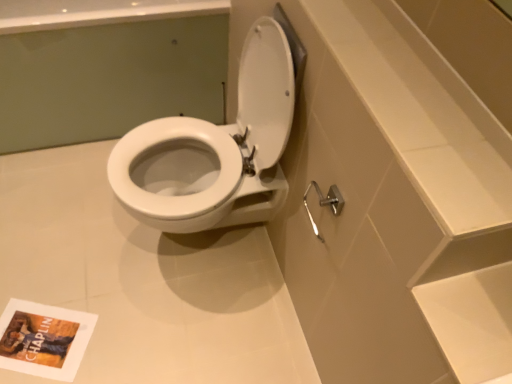
Question: Considering the relative positions of satin nickel shower arm at lower right and white glossy toilet at center in the image provided, is satin nickel shower arm at lower right to the right of white glossy toilet at center from the viewer's perspective?

Choices:
 (A) no
 (B) yes

Answer: (B)

Question: Does satin nickel shower arm at lower right have a lesser height compared to white glossy toilet at center?

Choices:
 (A) yes
 (B) no

Answer: (A)

Question: Does satin nickel shower arm at lower right have a lesser width compared to white glossy toilet at center?

Choices:
 (A) no
 (B) yes

Answer: (B)

Question: From the image's perspective, does satin nickel shower arm at lower right appear lower than white glossy toilet at center?

Choices:
 (A) no
 (B) yes

Answer: (B)

Question: Considering the relative positions of satin nickel shower arm at lower right and white glossy toilet at center in the image provided, is satin nickel shower arm at lower right in front of white glossy toilet at center?

Choices:
 (A) no
 (B) yes

Answer: (B)

Question: From the image's perspective, is white glossy toilet at center positioned above or below white glossy toilet at center?

Choices:
 (A) below
 (B) above

Answer: (B)

Question: From a real-world perspective, is white glossy toilet at center positioned above or below white glossy toilet at center?

Choices:
 (A) above
 (B) below

Answer: (A)

Question: Is point (204, 52) positioned closer to the camera than point (223, 294)?

Choices:
 (A) farther
 (B) closer

Answer: (A)

Question: In terms of height, does white glossy toilet at center look taller or shorter compared to white glossy toilet at center?

Choices:
 (A) tall
 (B) short

Answer: (A)

Question: Is matte paper book cover at lower left taller or shorter than white glossy toilet at center?

Choices:
 (A) short
 (B) tall

Answer: (A)

Question: Does point 48,340 appear closer or farther from the camera than point 10,6?

Choices:
 (A) farther
 (B) closer

Answer: (B)

Question: In terms of size, does matte paper book cover at lower left appear bigger or smaller than white glossy toilet at center?

Choices:
 (A) small
 (B) big

Answer: (A)

Question: Choose the correct answer: Is matte paper book cover at lower left inside white glossy toilet at center or outside it?

Choices:
 (A) inside
 (B) outside

Answer: (B)

Question: From the image's perspective, is white glossy toilet at center above or below matte paper book cover at lower left?

Choices:
 (A) above
 (B) below

Answer: (A)

Question: Is point (18, 180) positioned closer to the camera than point (18, 302)?

Choices:
 (A) farther
 (B) closer

Answer: (A)